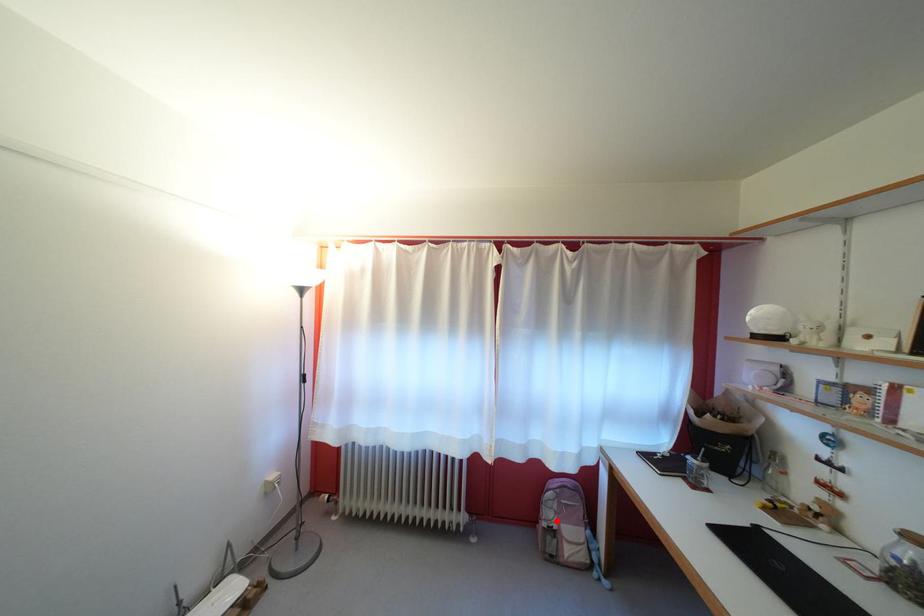
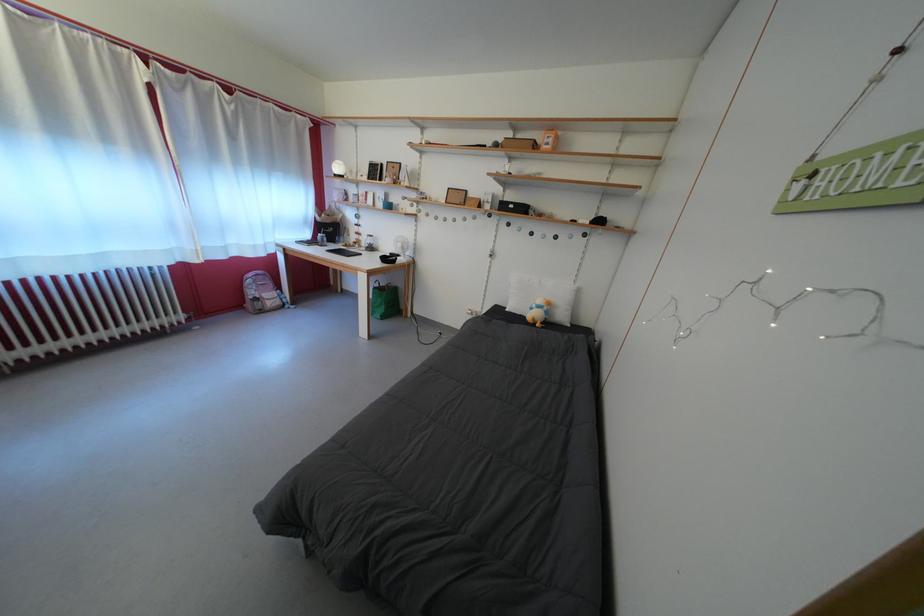
Locate, in the second image, the point that corresponds to the highlighted location in the first image.

(261, 299)